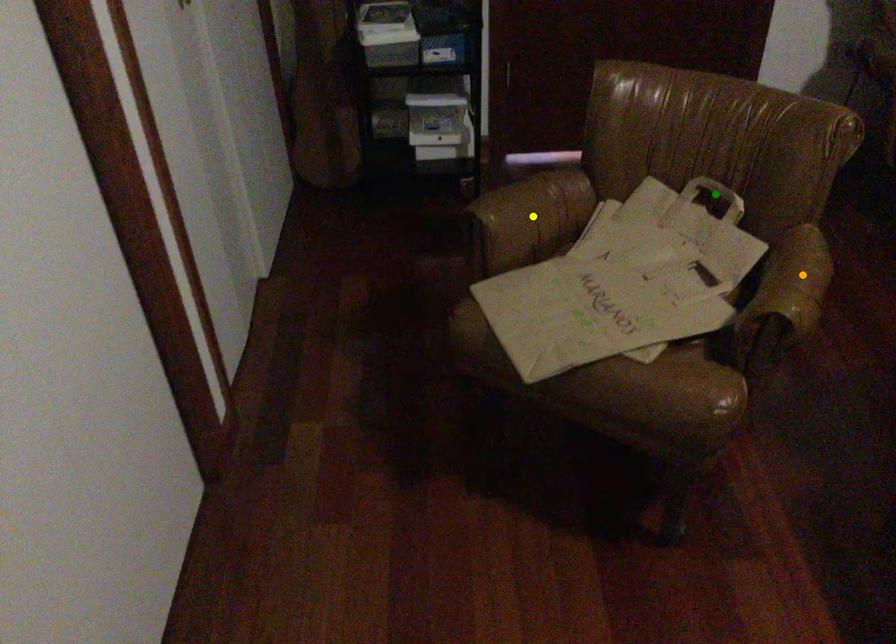
Order these from farthest to nearest:
- green point
- yellow point
- orange point

yellow point, green point, orange point